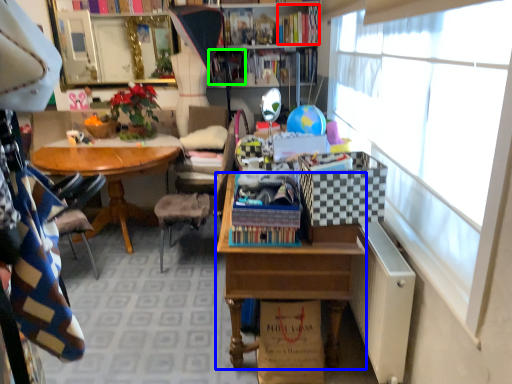
Question: Which object is the farthest from book (highlighted by a red box)? Choose among these: desk (highlighted by a blue box) or book (highlighted by a green box).

Choices:
 (A) desk
 (B) book

Answer: (A)